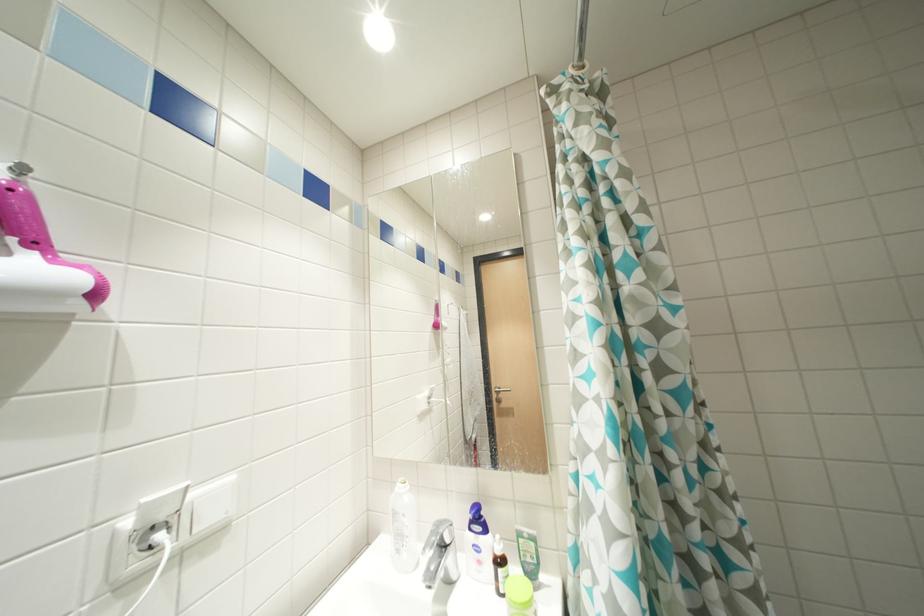
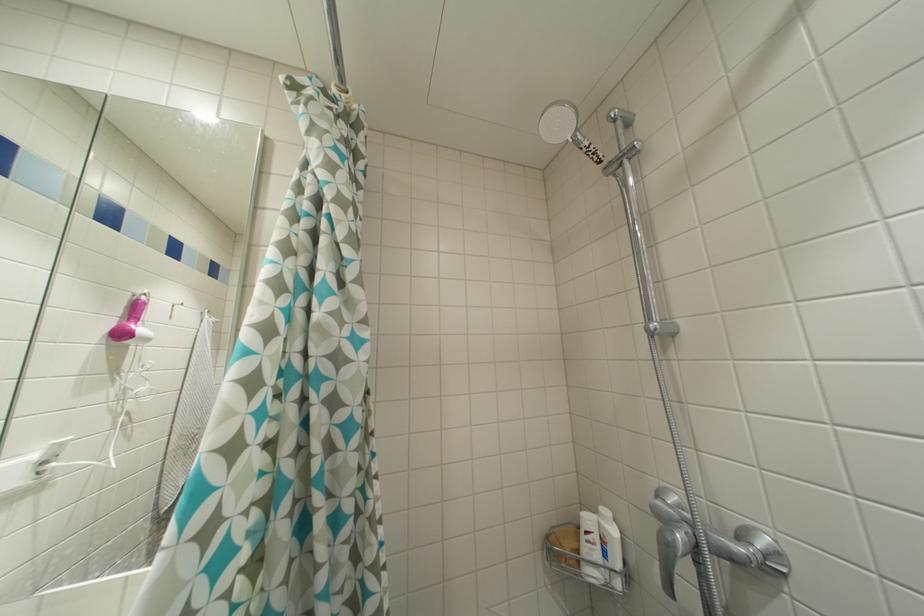
Question: The images are taken continuously from a first-person perspective. In which direction is your viewpoint rotating?

Choices:
 (A) Left
 (B) Right
 (C) Up
 (D) Down

Answer: (B)